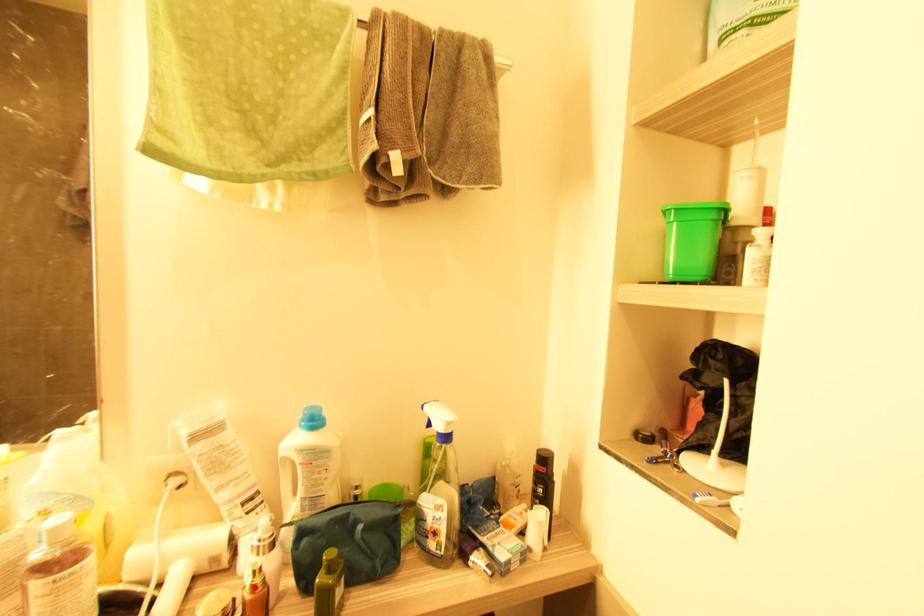
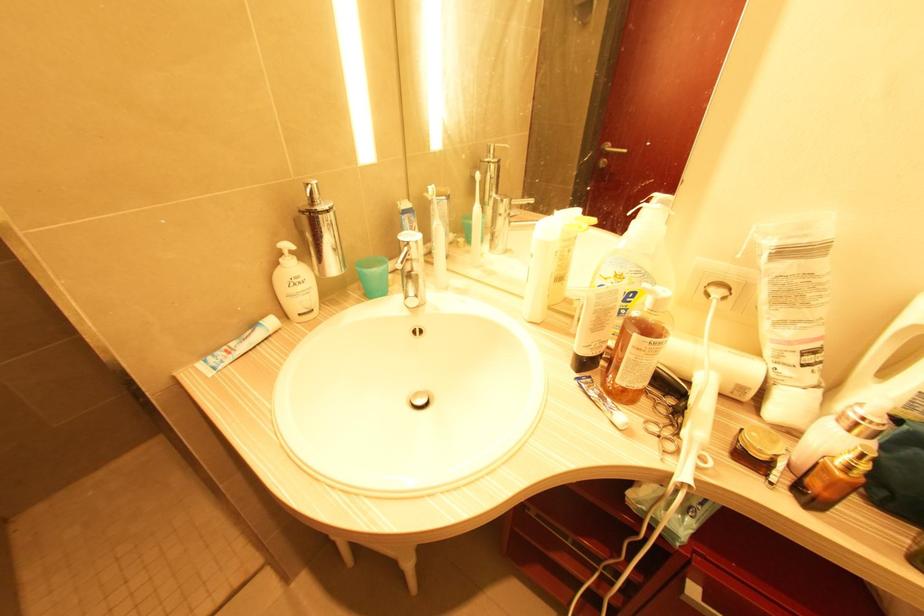
Question: I am providing you with two images of the same scene from different viewpoints. A red point is marked on the first image. Can you still see the location of the red point in image 2?

Choices:
 (A) Yes
 (B) No

Answer: (A)